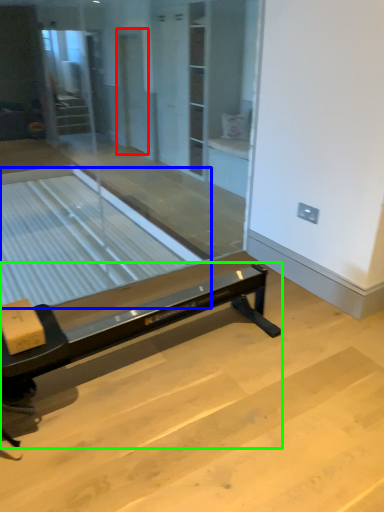
Question: Estimate the real-world distances between objects in this image. Which object is farther from screen door (highlighted by a red box), table (highlighted by a blue box) or furniture (highlighted by a green box)?

Choices:
 (A) table
 (B) furniture

Answer: (B)